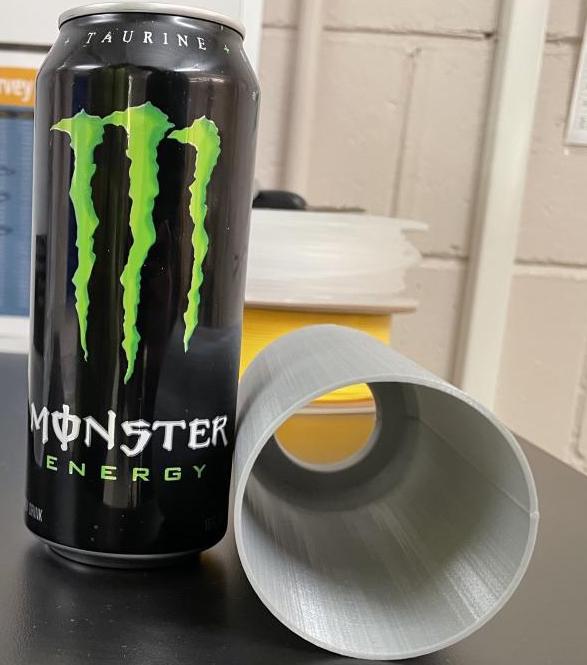
This screenshot has width=587, height=665. I want to click on black tabletop, so click(x=168, y=604).